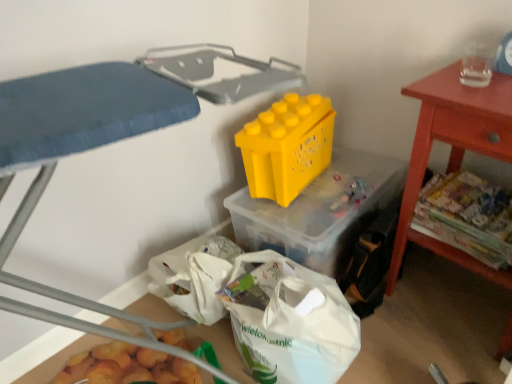
The height and width of the screenshot is (384, 512). In order to click on vacant space underneath smooth red table at right (from a real-world perspective) in this screenshot , I will do `click(459, 297)`.